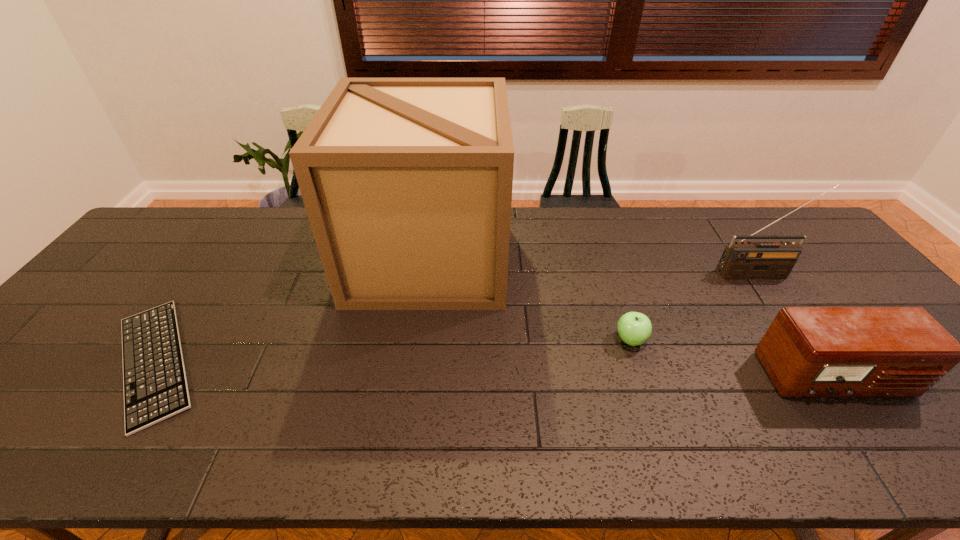
Where is `empty space between the nearer radio receiver and the apple`? empty space between the nearer radio receiver and the apple is located at coordinates (732, 359).

The image size is (960, 540). What are the coordinates of `vacant point located between the fourth tallest object and the shortest object` in the screenshot? It's located at (393, 350).

Identify the location of object that is the fourth closest to the farther radio receiver. Image resolution: width=960 pixels, height=540 pixels. (155, 386).

Point out which object is positioned as the third nearest to the apple. Please provide its 2D coordinates. Your answer should be formatted as a tuple, i.e. [(x, y)], where the tuple contains the x and y coordinates of a point satisfying the conditions above.

[(740, 260)]

Identify the location of vacant point that satisfies the following two spatial constraints: 1. on the reinforced sides of the tallest object; 2. on the right side of the apple. coord(417,340).

Find the location of `free spot that satisfies the following two spatial constraints: 1. on the reinforced sides of the box; 2. on the front side of the computer keyboard`. free spot that satisfies the following two spatial constraints: 1. on the reinforced sides of the box; 2. on the front side of the computer keyboard is located at coordinates (414, 361).

Image resolution: width=960 pixels, height=540 pixels. In order to click on vacant space that satisfies the following two spatial constraints: 1. on the reinforced sides of the tallest object; 2. on the back side of the second shortest object in this screenshot , I will do `click(417, 340)`.